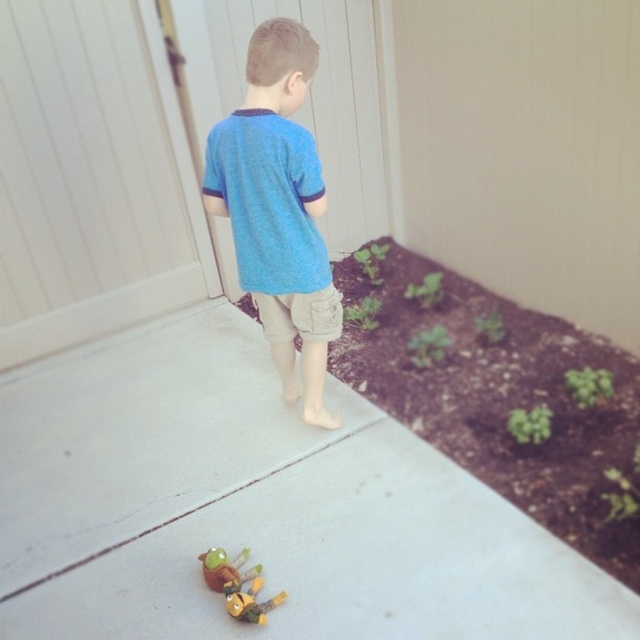
Question: Which of the following is the closest to the observer?

Choices:
 (A) green mulch at lower right
 (B) white concrete pavement at center
 (C) plush yellow toy at lower center

Answer: (B)

Question: Does green mulch at lower right lie behind plush yellow toy at lower center?

Choices:
 (A) yes
 (B) no

Answer: (A)

Question: From the image, what is the correct spatial relationship of white concrete pavement at center in relation to blue cotton shirt at center?

Choices:
 (A) above
 (B) below

Answer: (B)

Question: Considering the real-world distances, which object is closest to the white concrete pavement at center?

Choices:
 (A) blue cotton shirt at center
 (B) plush yellow toy at lower center

Answer: (B)

Question: Among these points, which one is farthest from the camera?

Choices:
 (A) (227, 579)
 (B) (461, 294)
 (C) (301, 305)
 (D) (205, 396)

Answer: (B)

Question: Can you confirm if green mulch at lower right is smaller than blue cotton shirt at center?

Choices:
 (A) yes
 (B) no

Answer: (B)